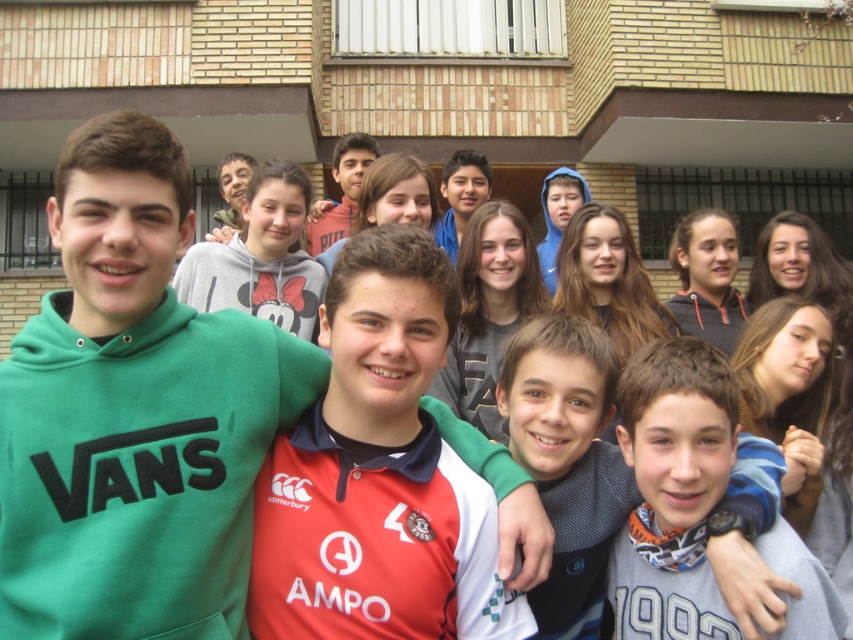
What are the coordinates of the gray knit sweater at center?

The gray knit sweater at center is located at coordinates point [567,460].

You are standing in front of the brick building and notice two people wearing the gray knit sweater at center and the matte blue hoodie at center. Which person is standing closer to you?

The gray knit sweater at center is closer to the viewer than the matte blue hoodie at center, so the person wearing the gray knit sweater at center is standing closer to you.

You are a photographer trying to adjust the focus of your camera. The red jersey at center and the matte blue hoodie at center are both in the frame. Which one should you focus on first if you want to ensure the larger object is sharp?

The red jersey at center is larger in size than the matte blue hoodie at center, so you should focus on the red jersey at center first to ensure the larger object is sharp.